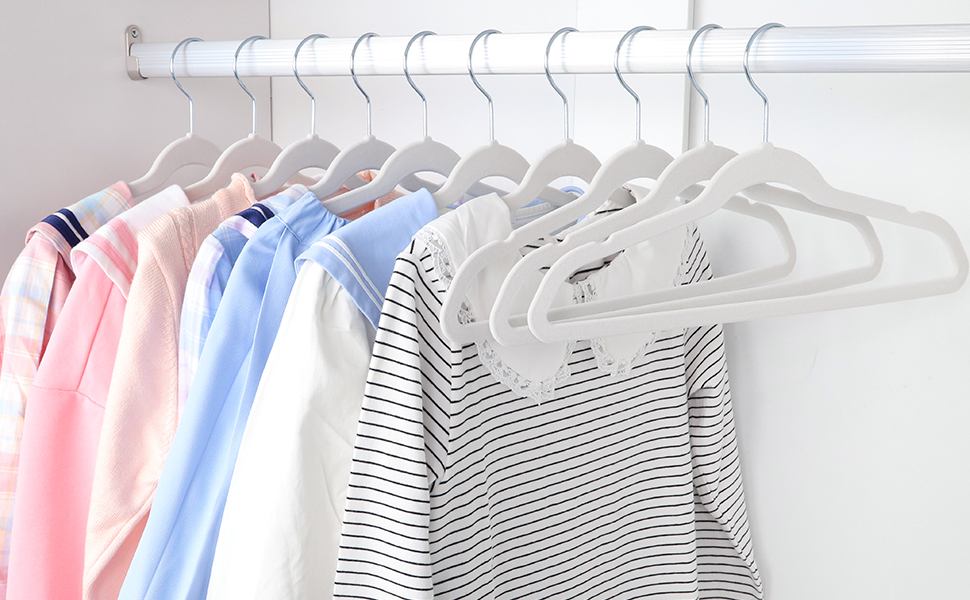
Find the location of a particular element. The width and height of the screenshot is (970, 600). clothes hangers is located at coordinates (191, 147), (241, 154), (306, 151), (363, 154), (422, 153), (487, 163), (561, 163), (630, 163), (694, 165), (753, 172).